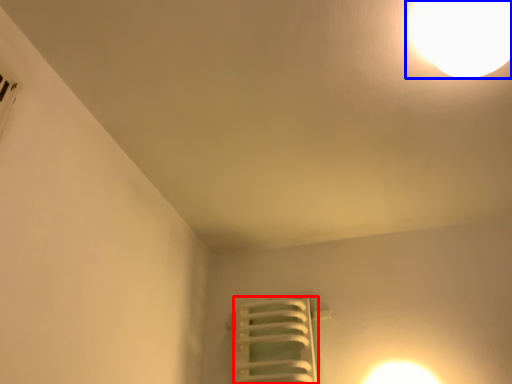
Question: Which of the following is the farthest to the observer, radiator (highlighted by a red box) or lamp (highlighted by a blue box)?

Choices:
 (A) radiator
 (B) lamp

Answer: (A)